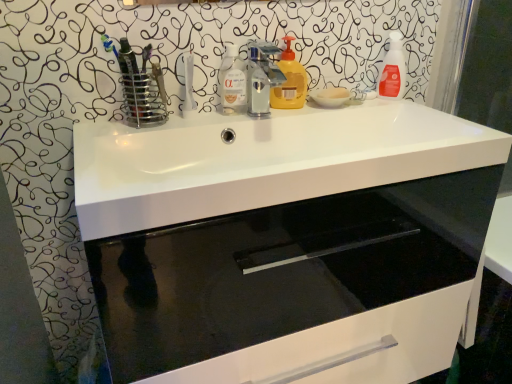
Locate an element on the screen. The width and height of the screenshot is (512, 384). vacant space to the right of transparent liquid at center, the third cleaning product when ordered from right to left is located at coordinates (284, 109).